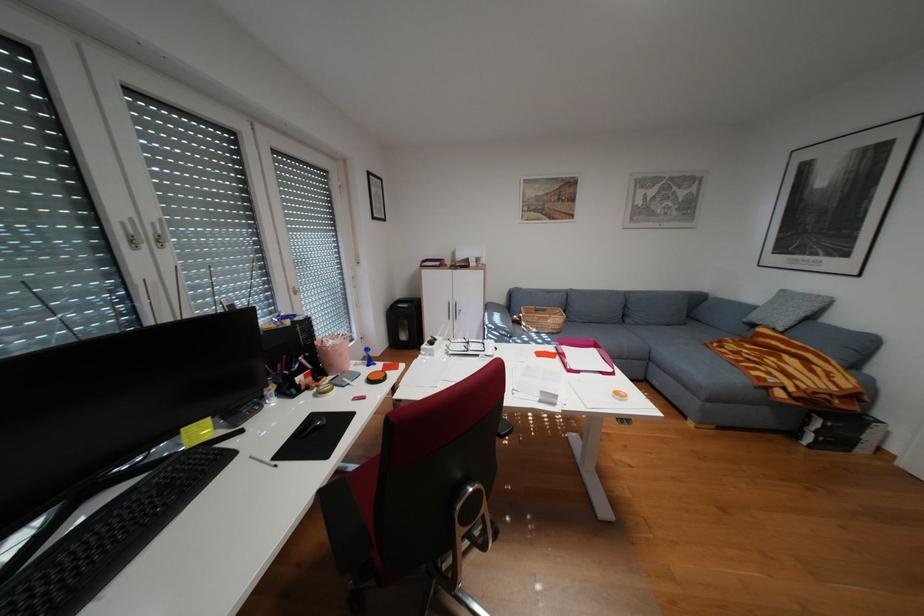
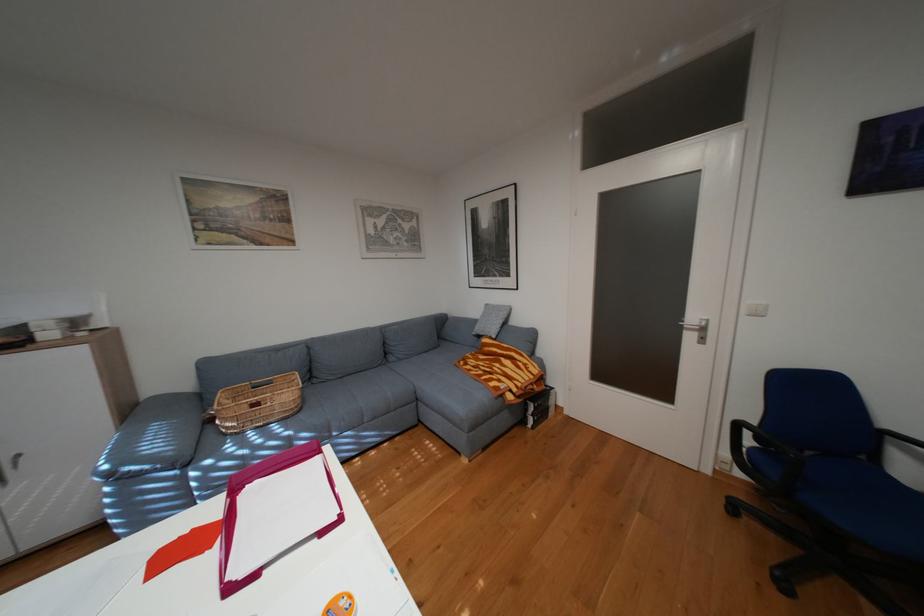
Question: The first image is from the beginning of the video and the second image is from the end. How did the camera likely rotate when shooting the video?

Choices:
 (A) Left
 (B) Right
 (C) Up
 (D) Down

Answer: (B)